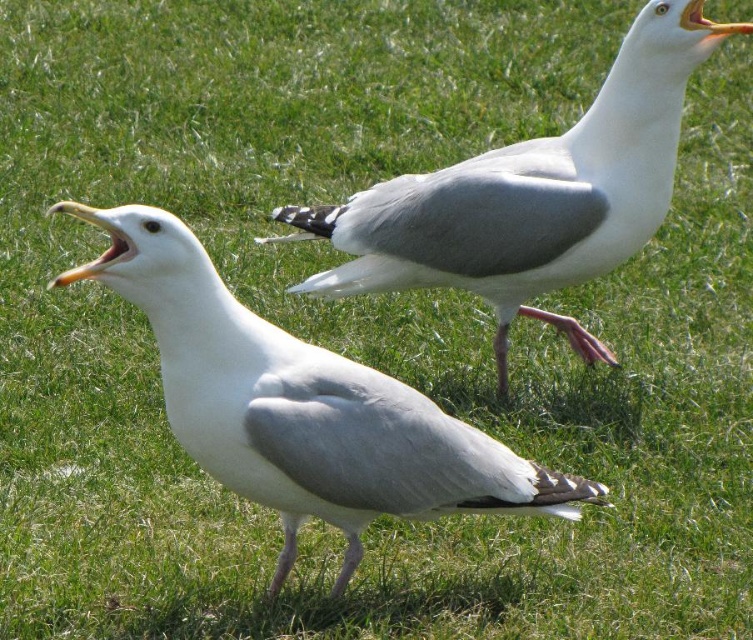
Is white matte seagull at center smaller than white matte seagull at upper center?

Yes.

Which is in front, point (142, 284) or point (575, 276)?

Point (142, 284)

Is point (206, 449) less distant than point (639, 106)?

Yes, point (206, 449) is closer to viewer.

The height and width of the screenshot is (640, 753). I want to click on white matte seagull at center, so click(300, 404).